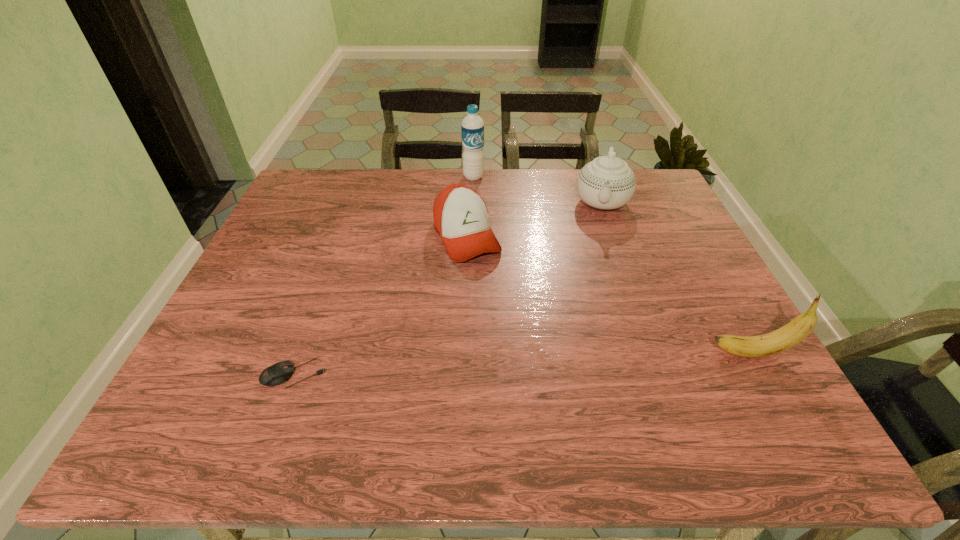
I want to click on free space on the desktop that is between the mouse and the banana and is positioned on the front-facing side of the fourth tallest object, so click(544, 362).

Find the location of a particular element. The height and width of the screenshot is (540, 960). free space on the desktop that is between the leftmost object and the banana and is positioned on the label of the tallest object is located at coordinates (498, 364).

At what (x,y) coordinates should I click in order to perform the action: click on free space on the desktop that is between the mouse and the rightmost object and is positioned on the spout of the fourth object from left to right. Please return your answer as a coordinate pair (x, y). Looking at the image, I should click on (582, 361).